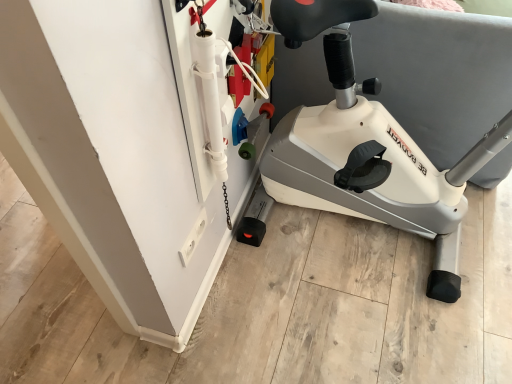
You are a GUI agent. You are given a task and a screenshot of the screen. Output one action in this format:
    pyautogui.click(x=<x>, y=<y>)
    Task: Click on the vacant space in front of white plastic stationary bicycle at center
    This screenshot has width=512, height=384.
    Given the screenshot: What is the action you would take?
    pyautogui.click(x=382, y=332)